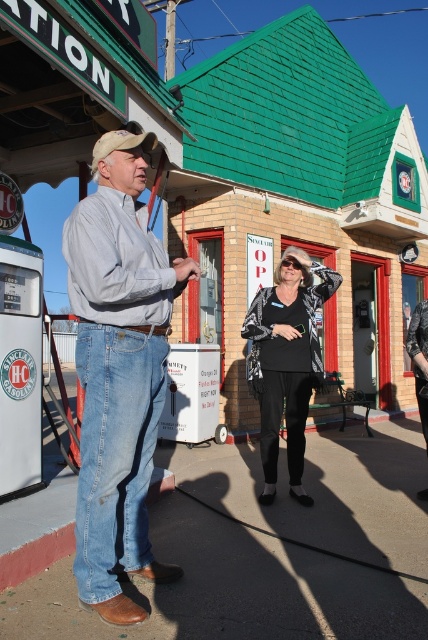
You are designing a new layout for a clothing store and need to arrange two items displayed in the image. The denim jeans at left and the metallic silver jacket at center must be placed side by side. Given their widths, which item should be placed on the left to ensure they fit within a 1.5 meter wide display shelf?

The denim jeans at left should be placed on the left side of the metallic silver jacket at center because the denim jeans at left is narrower than the metallic silver jacket at center, allowing both to fit within the 1.5 meter wide display shelf.